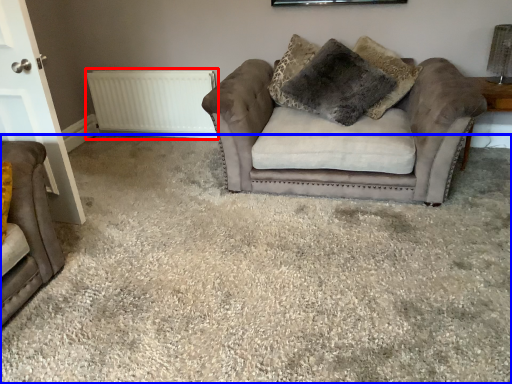
Question: Which of the following is the closest to the observer, radiator (highlighted by a red box) or plain (highlighted by a blue box)?

Choices:
 (A) radiator
 (B) plain

Answer: (B)